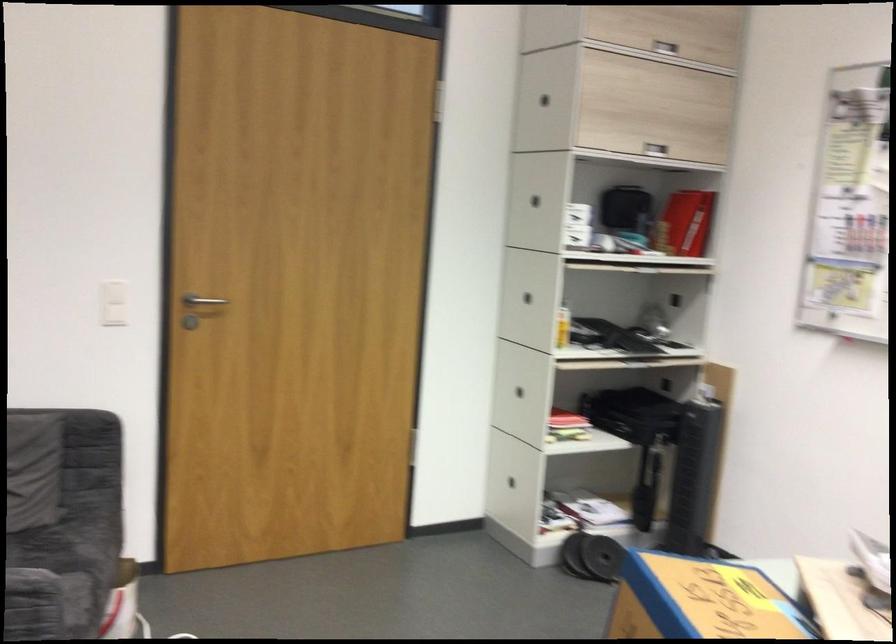
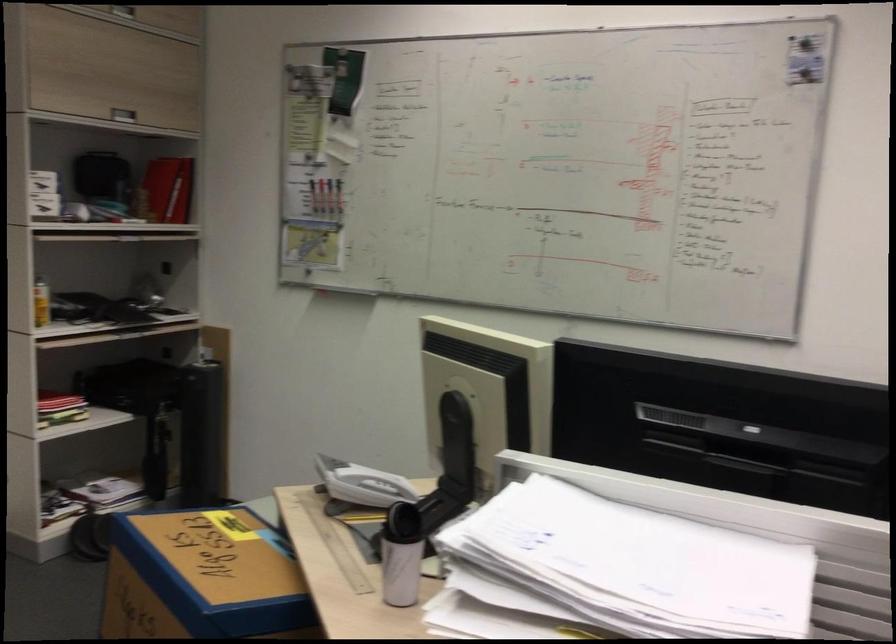
Locate, in the second image, the point that corresponds to (563,321) in the first image.

(40, 303)